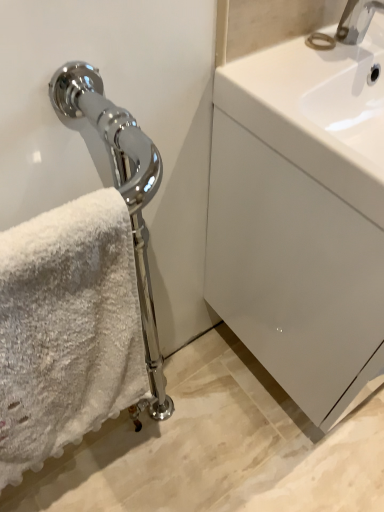
Question: Is white glossy sink at upper right thinner than white fluffy towel at left?

Choices:
 (A) yes
 (B) no

Answer: (B)

Question: Is white glossy sink at upper right not close to white fluffy towel at left?

Choices:
 (A) no
 (B) yes

Answer: (A)

Question: Is white fluffy towel at left at the back of white glossy sink at upper right?

Choices:
 (A) yes
 (B) no

Answer: (B)

Question: Can you confirm if white glossy sink at upper right is bigger than white fluffy towel at left?

Choices:
 (A) yes
 (B) no

Answer: (A)

Question: Considering the relative sizes of white glossy sink at upper right and white fluffy towel at left in the image provided, is white glossy sink at upper right wider than white fluffy towel at left?

Choices:
 (A) no
 (B) yes

Answer: (B)

Question: Is white glossy sink at upper right at the left side of white fluffy towel at left?

Choices:
 (A) yes
 (B) no

Answer: (B)

Question: Is white fluffy towel at left looking in the opposite direction of white glossy drawer at right?

Choices:
 (A) no
 (B) yes

Answer: (A)

Question: Considering the relative positions of white fluffy towel at left and white glossy drawer at right in the image provided, is white fluffy towel at left to the right of white glossy drawer at right from the viewer's perspective?

Choices:
 (A) yes
 (B) no

Answer: (B)

Question: From a real-world perspective, is white fluffy towel at left beneath white glossy drawer at right?

Choices:
 (A) no
 (B) yes

Answer: (A)

Question: Is white fluffy towel at left thinner than white glossy drawer at right?

Choices:
 (A) no
 (B) yes

Answer: (B)

Question: Is white fluffy towel at left next to white glossy drawer at right?

Choices:
 (A) yes
 (B) no

Answer: (B)

Question: Does white fluffy towel at left have a greater height compared to white glossy drawer at right?

Choices:
 (A) no
 (B) yes

Answer: (A)

Question: Is chrome metallic faucet at upper right further to the viewer compared to white glossy sink at upper right?

Choices:
 (A) no
 (B) yes

Answer: (B)